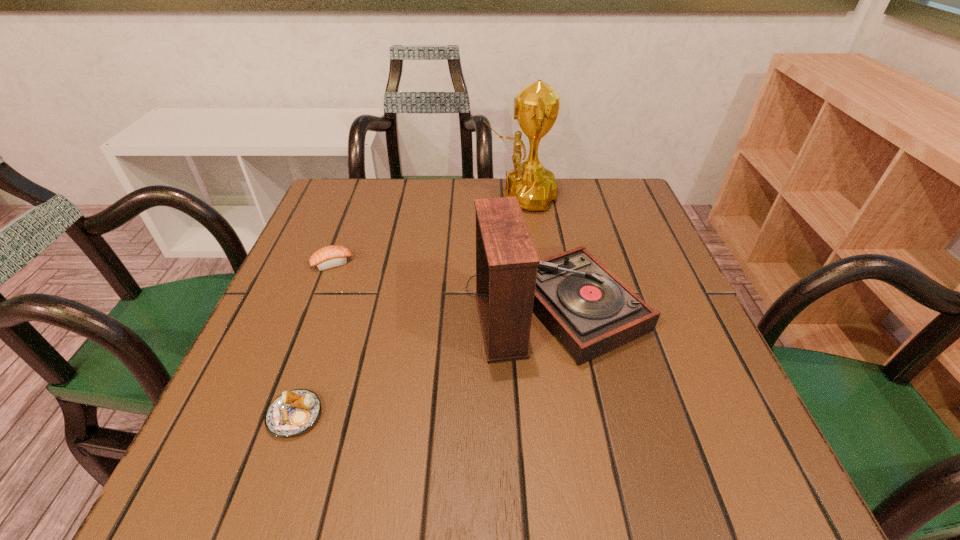
The image size is (960, 540). Find the location of `vacant region at the left edge of the desktop`. vacant region at the left edge of the desktop is located at coordinates (328, 392).

I want to click on vacant space at the right edge of the desktop, so click(664, 302).

Locate an element on the screen. This screenshot has width=960, height=540. vacant space at the far left corner is located at coordinates (367, 211).

In the image, there is a desktop. Find the location of `vacant space at the far right corner`. vacant space at the far right corner is located at coordinates point(596,203).

The image size is (960, 540). In the image, there is a desktop. Identify the location of vacant space at the near right corner. (723, 454).

Locate an element on the screen. Image resolution: width=960 pixels, height=540 pixels. empty space that is in between the pastry and the third shortest object is located at coordinates (425, 362).

The image size is (960, 540). I want to click on vacant region between the third tallest object and the second tallest object, so [x=444, y=286].

Find the location of a particular element. The image size is (960, 540). empty space that is in between the phonograph record and the tallest object is located at coordinates (538, 253).

Image resolution: width=960 pixels, height=540 pixels. Identify the location of vacant area that lies between the sushi and the shortest object. (313, 340).

This screenshot has width=960, height=540. I want to click on vacant space in between the farthest object and the sushi, so click(425, 230).